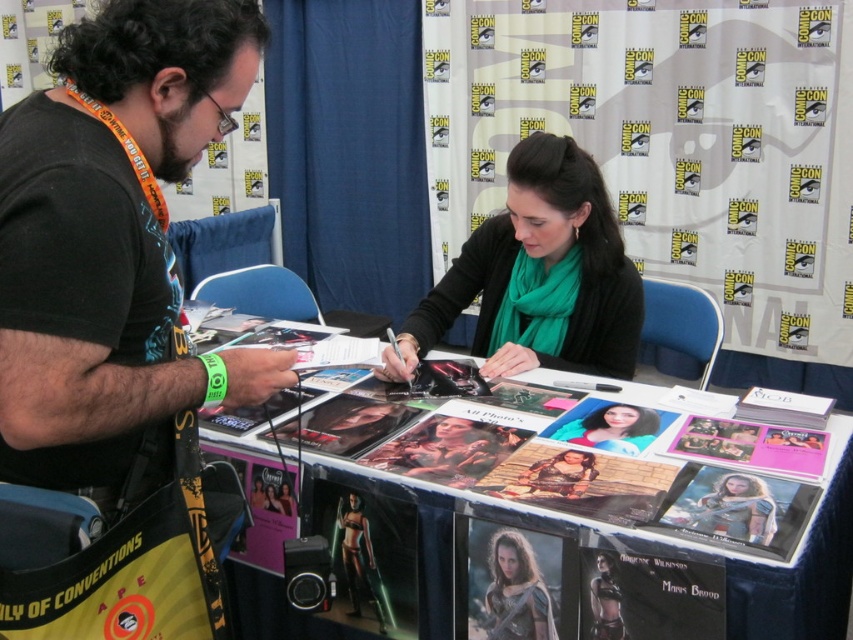
Question: Considering the relative positions of green fabric scarf at center and smooth skin portrait at center in the image provided, where is green fabric scarf at center located with respect to smooth skin portrait at center?

Choices:
 (A) below
 (B) above

Answer: (B)

Question: Which of the following is the closest to the observer?

Choices:
 (A) green fabric scarf at center
 (B) metallic silver photo at center

Answer: (B)

Question: Estimate the real-world distances between objects in this image. Which object is farther from the black matte t-shirt at left?

Choices:
 (A) black matte scarf at center
 (B) green fabric scarf at center
 (C) black leather outfit at lower right

Answer: (B)

Question: Is green fabric scarf at center wider than black leather outfit at lower right?

Choices:
 (A) yes
 (B) no

Answer: (A)

Question: Which point is farther to the camera?

Choices:
 (A) black leather outfit at lower right
 (B) black matte scarf at center
 (C) metallic silver photo at center

Answer: (B)

Question: Observing the image, what is the correct spatial positioning of black matte t-shirt at left in reference to metallic silver photo at center?

Choices:
 (A) above
 (B) below

Answer: (A)